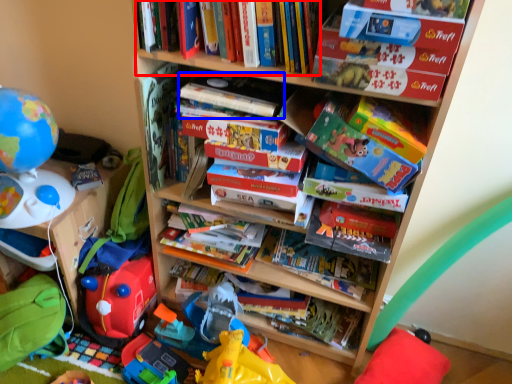
Question: Which of the following is the farthest to the observer, book (highlighted by a red box) or paperback book (highlighted by a blue box)?

Choices:
 (A) book
 (B) paperback book

Answer: (B)